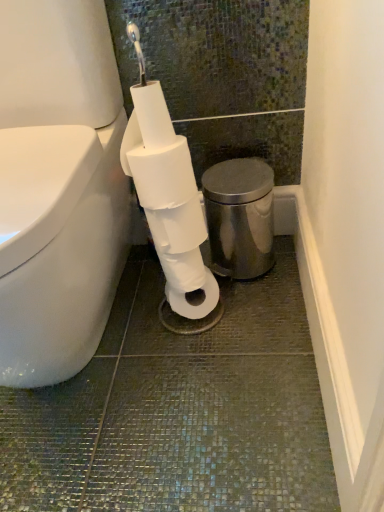
Question: Is polished stainless steel bidet at right situated inside white matte toilet paper at center, the first toilet paper in the bottom-to-top sequence, or outside?

Choices:
 (A) outside
 (B) inside

Answer: (A)

Question: Relative to white matte toilet paper at center, which is counted as the second toilet paper, starting from the top, is polished stainless steel bidet at right in front or behind?

Choices:
 (A) front
 (B) behind

Answer: (B)

Question: Which of these objects is positioned closest to the polished stainless steel bidet at right?

Choices:
 (A) white matte toilet paper at center, positioned as the 1th toilet paper in top-to-bottom order
 (B) white matte toilet paper at center, which is counted as the second toilet paper, starting from the top

Answer: (B)

Question: Estimate the real-world distances between objects in this image. Which object is farther from the polished stainless steel bidet at right?

Choices:
 (A) white matte toilet paper at center, which is counted as the second toilet paper, starting from the top
 (B) white matte toilet paper at center, positioned as the 1th toilet paper in top-to-bottom order

Answer: (B)